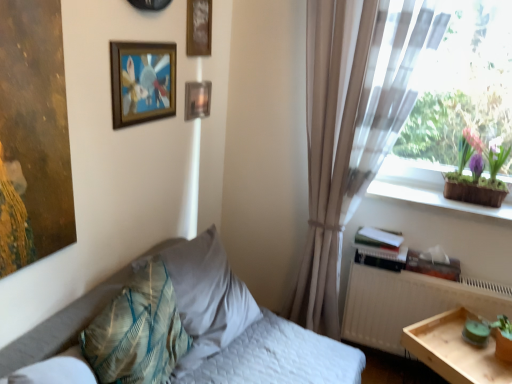
Image resolution: width=512 pixels, height=384 pixels. I want to click on empty space that is ontop of green wood window sill at upper right (from a real-world perspective), so click(x=446, y=198).